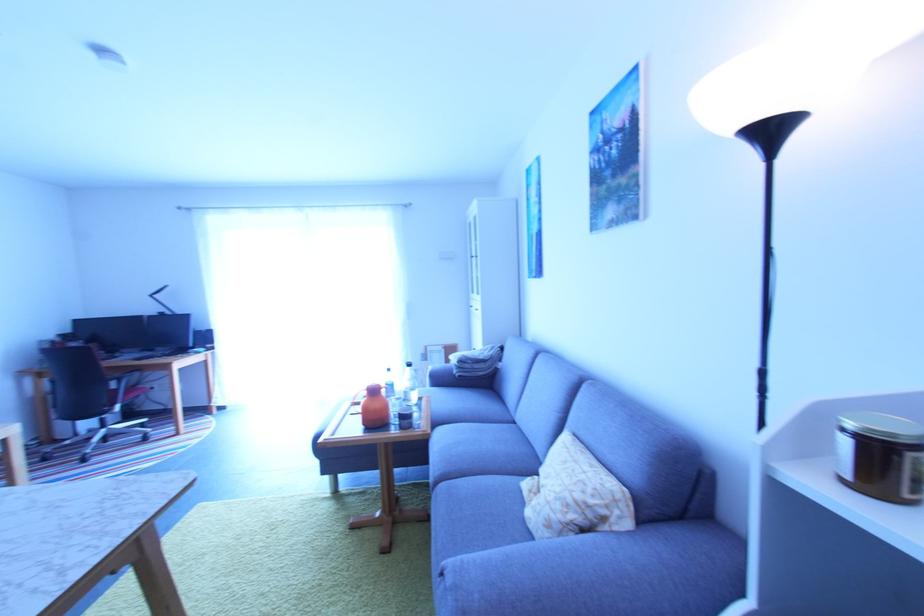
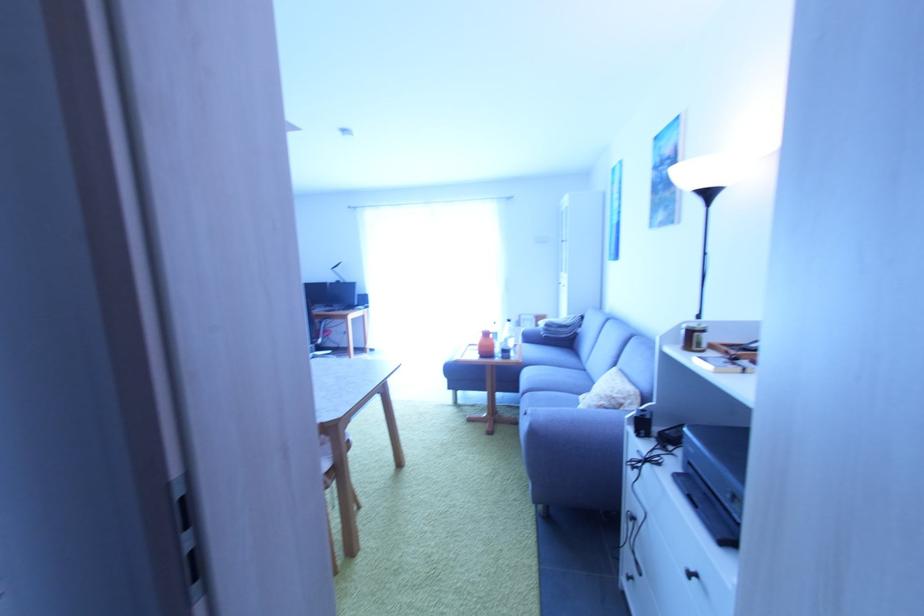
Locate, in the second image, the point that corresponds to (x=406, y=429) in the first image.

(507, 360)